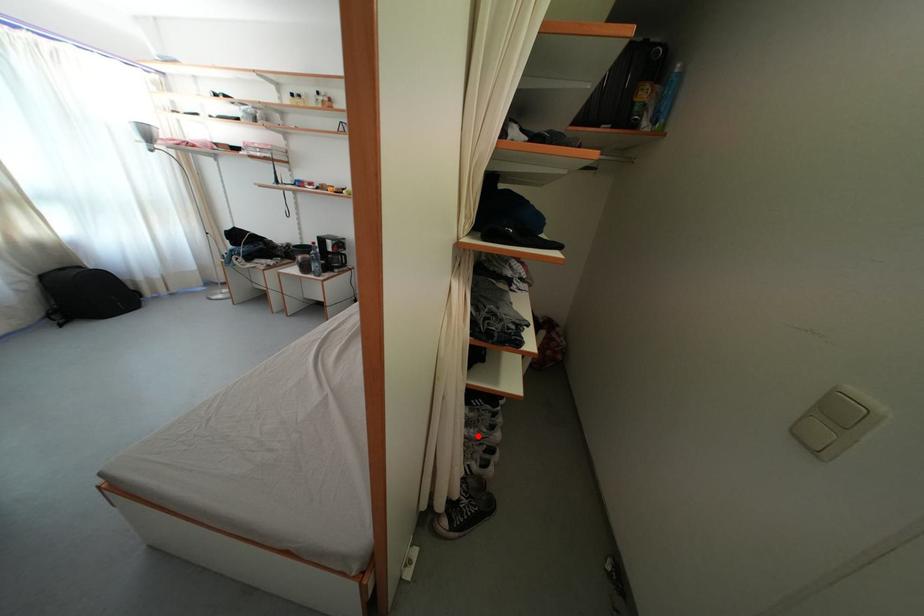
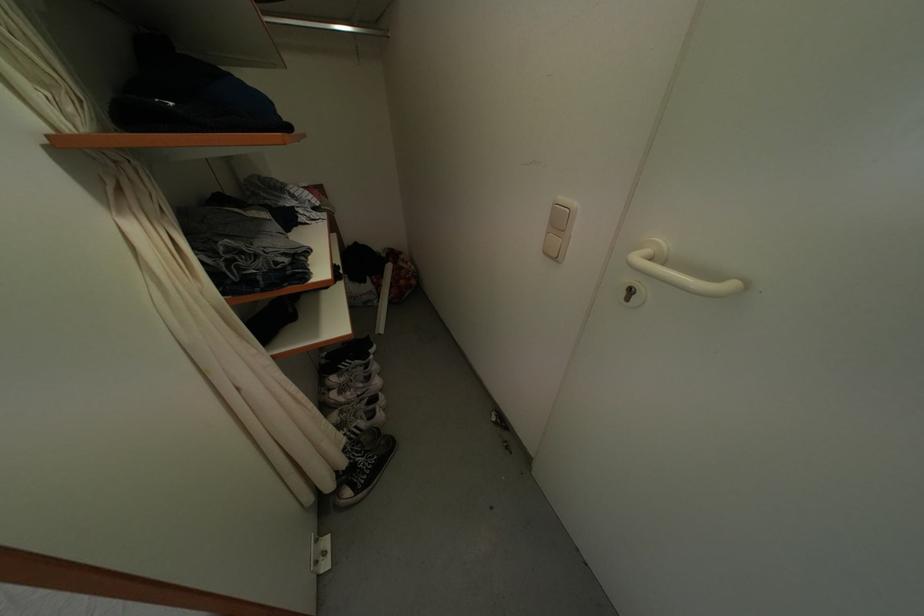
The point at the highlighted location is marked in the first image. Where is the corresponding point in the second image?

(354, 399)